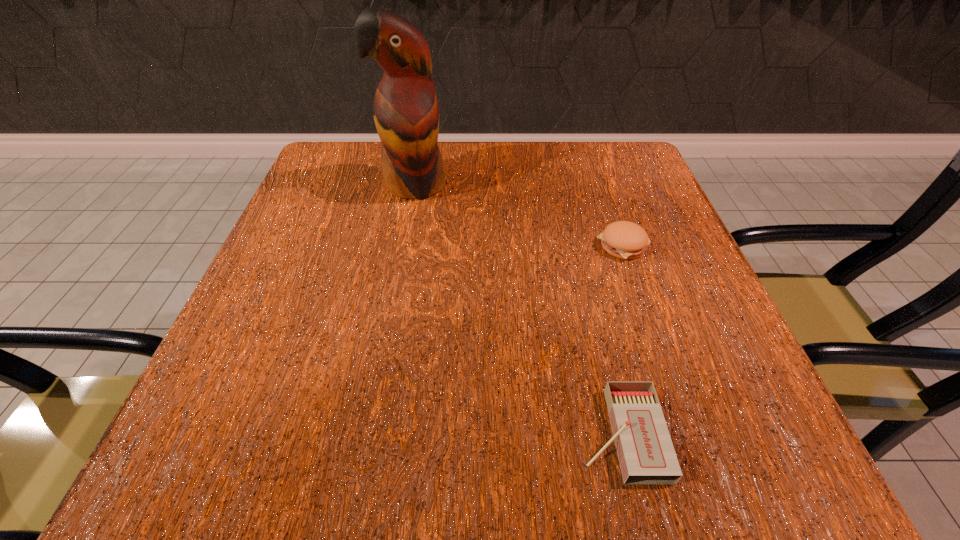
The image size is (960, 540). What are the coordinates of `vacant space at the far right corner` in the screenshot? It's located at (583, 144).

The width and height of the screenshot is (960, 540). In order to click on vacant point located between the patty and the nearest object in this screenshot , I will do `click(622, 340)`.

The image size is (960, 540). I want to click on free point between the nearest object and the leftmost object, so click(x=517, y=309).

Find the location of `vacant area that lies between the nearest object and the patty`. vacant area that lies between the nearest object and the patty is located at coordinates (622, 340).

The image size is (960, 540). I want to click on blank region between the second nearest object and the leftmost object, so click(x=518, y=215).

Locate an element on the screen. Image resolution: width=960 pixels, height=540 pixels. empty space between the leftmost object and the second nearest object is located at coordinates (518, 215).

At what (x,y) coordinates should I click in order to perform the action: click on free point between the parrot and the second nearest object. Please return your answer as a coordinate pair (x, y). This screenshot has width=960, height=540. Looking at the image, I should click on (518, 215).

The image size is (960, 540). In order to click on empty space between the parrot and the matchbox in this screenshot , I will do tap(517, 309).

This screenshot has height=540, width=960. In order to click on free spot between the second farthest object and the tallest object in this screenshot , I will do [x=518, y=215].

The width and height of the screenshot is (960, 540). What are the coordinates of `vacant space that is in between the second farthest object and the tallest object` in the screenshot? It's located at (518, 215).